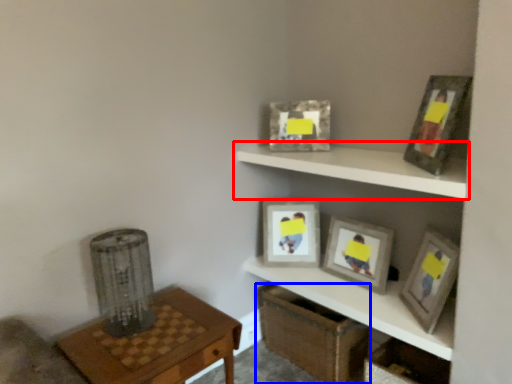
Question: Which object appears closest to the camera in this image, shelf (highlighted by a red box) or crate (highlighted by a blue box)?

Choices:
 (A) shelf
 (B) crate

Answer: (A)